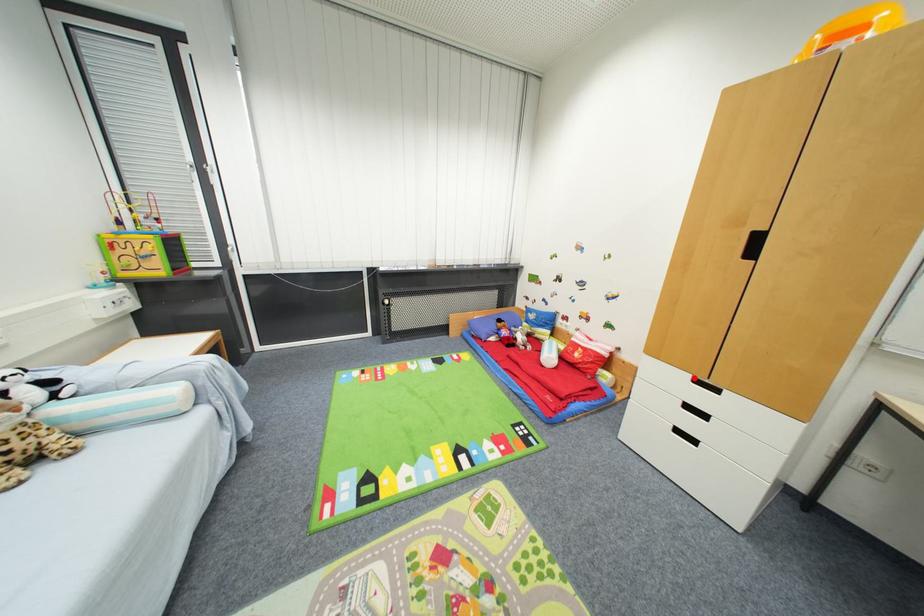
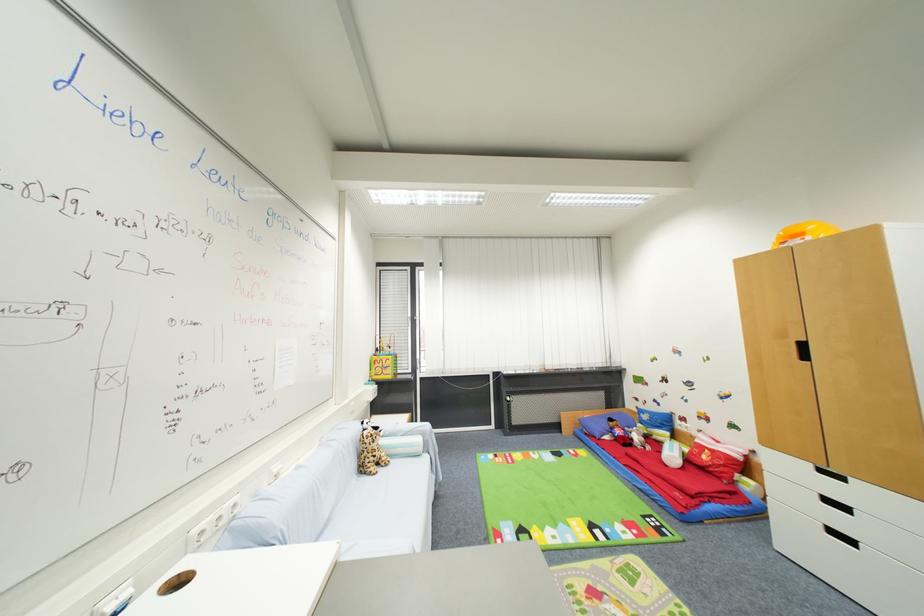
Question: I am providing you with two images of the same scene from different viewpoints. Given a red point in image1, look at the same physical point in image2. Is it:

Choices:
 (A) Closer to the viewpoint
 (B) Farther from the viewpoint

Answer: (A)